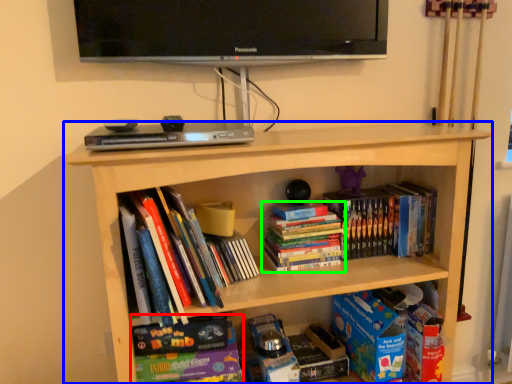
Question: Estimate the real-world distances between objects in this image. Which object is farther from book (highlighted by a red box), bookcase (highlighted by a blue box) or book (highlighted by a green box)?

Choices:
 (A) bookcase
 (B) book

Answer: (A)